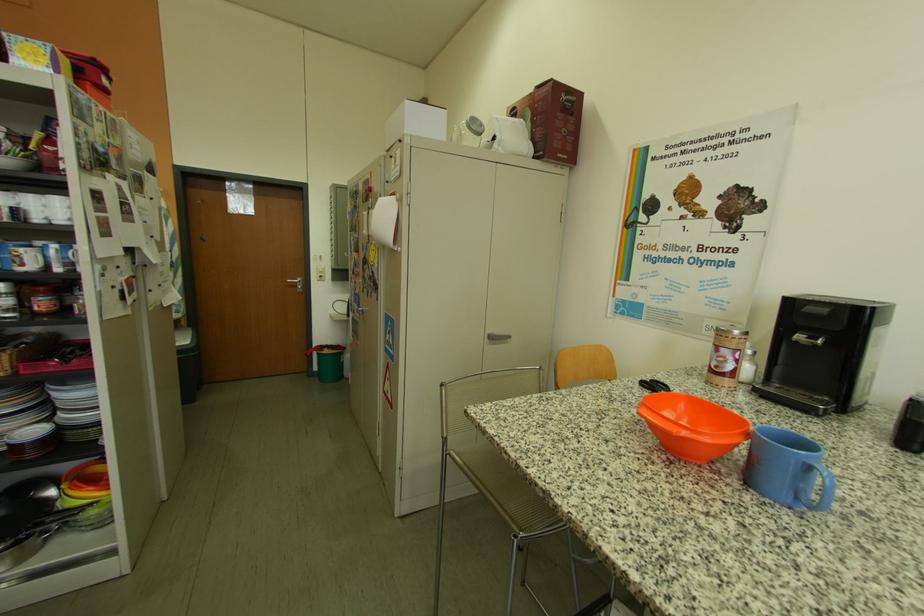
Find the location of a particular element. blue mug handle is located at coordinates (786, 468).